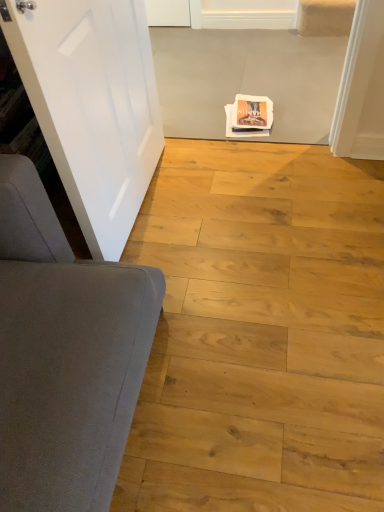
This screenshot has height=512, width=384. I want to click on empty space that is to the right of white matte door at left, so click(x=226, y=198).